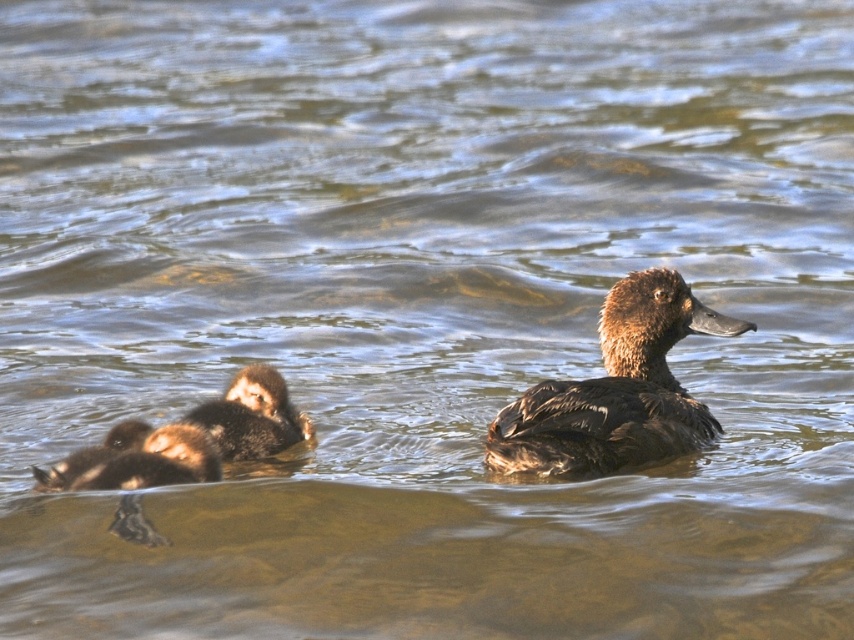
Question: Which point is closer to the camera?

Choices:
 (A) brown matte duck at center
 (B) brown fuzzy duckling at lower left
 (C) dark brown fluffy duckling at lower left

Answer: (C)

Question: Is brown matte duck at center to the left of dark brown fluffy duckling at lower left from the viewer's perspective?

Choices:
 (A) yes
 (B) no

Answer: (B)

Question: Does dark brown fluffy duckling at lower left have a greater width compared to brown fuzzy duckling at lower left?

Choices:
 (A) yes
 (B) no

Answer: (A)

Question: In this image, where is brown matte duck at center located relative to brown fuzzy duckling at lower left?

Choices:
 (A) below
 (B) above

Answer: (B)

Question: Which point is farther to the camera?

Choices:
 (A) brown matte duck at center
 (B) dark brown fluffy duckling at lower left
 (C) brown fuzzy duckling at lower left

Answer: (C)

Question: Which object is the farthest from the dark brown fluffy duckling at lower left?

Choices:
 (A) brown fuzzy duckling at lower left
 (B) brown matte duck at center

Answer: (B)